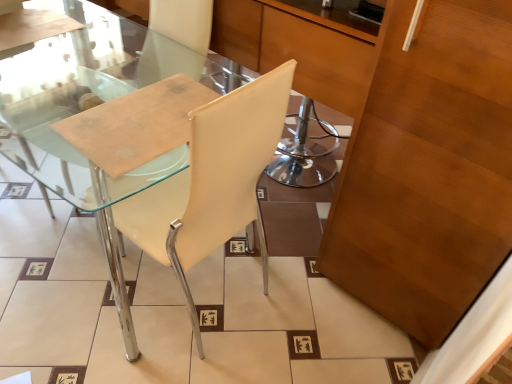
Question: In terms of size, does wooden cabinet at right appear bigger or smaller than transparent glass table at left?

Choices:
 (A) big
 (B) small

Answer: (A)

Question: From a real-world perspective, is wooden cabinet at right above or below transparent glass table at left?

Choices:
 (A) below
 (B) above

Answer: (B)

Question: Which object is the farthest from the white leather chair at center?

Choices:
 (A) wooden cabinet at right
 (B) transparent glass table at left

Answer: (B)

Question: Which of these objects is positioned closest to the white leather chair at center?

Choices:
 (A) wooden cabinet at right
 (B) transparent glass table at left

Answer: (A)